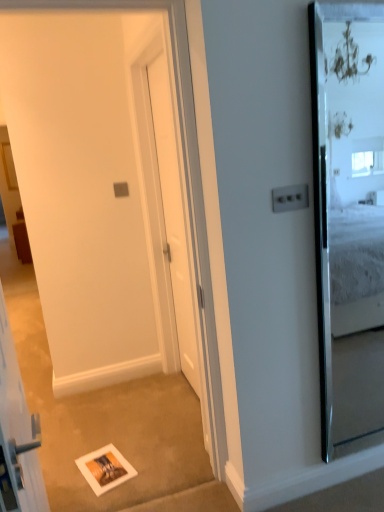
What are the coordinates of `free point below white matte barn door at center (from a real-world perspective)` in the screenshot? It's located at (133, 490).